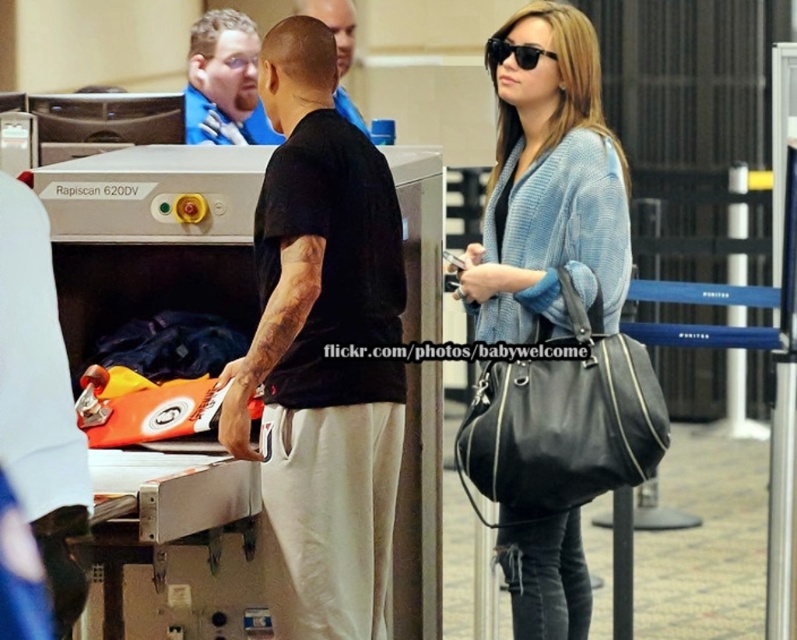
Who is higher up, black matte t-shirt at center or shiny blue shirt at center?

Positioned higher is shiny blue shirt at center.

The image size is (797, 640). In order to click on black matte t-shirt at center in this screenshot , I will do `click(320, 352)`.

Consider the image. Does black matte t-shirt at center have a smaller size compared to light blue knitted sweater at center?

No, black matte t-shirt at center is not smaller than light blue knitted sweater at center.

Can you confirm if black matte t-shirt at center is positioned above light blue knitted sweater at center?

Incorrect, black matte t-shirt at center is not positioned above light blue knitted sweater at center.

The height and width of the screenshot is (640, 797). Find the location of `black matte t-shirt at center`. black matte t-shirt at center is located at coordinates (320, 352).

Find the location of a particular element. The image size is (797, 640). black matte t-shirt at center is located at coordinates (320, 352).

Can you confirm if light blue knitted sweater at center is positioned to the left of blue fabric shirt at upper left?

Incorrect, light blue knitted sweater at center is not on the left side of blue fabric shirt at upper left.

Between point (607, 260) and point (207, 36), which one is positioned behind?

The point (207, 36) is more distant.

Who is more forward, (605, 132) or (222, 104)?

Point (605, 132) is more forward.

Locate an element on the screen. The width and height of the screenshot is (797, 640). light blue knitted sweater at center is located at coordinates (548, 188).